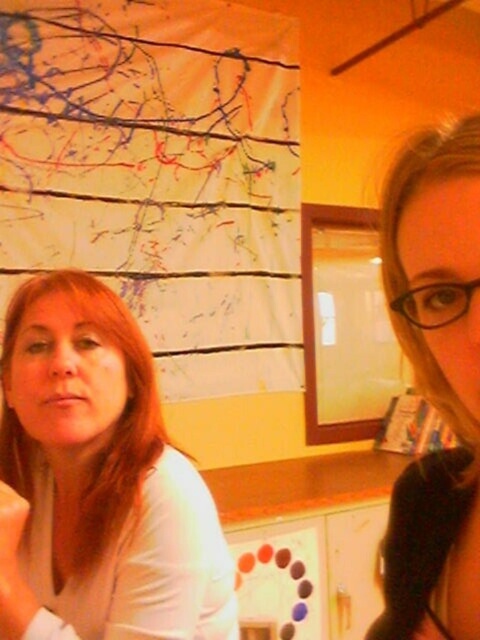
Between smooth beige shirt at left and smooth blonde hair at center, which one has more height?

Standing taller between the two is smooth beige shirt at left.

Is point (189, 582) positioned before point (471, 188)?

That is False.

Locate an element on the screen. This screenshot has width=480, height=640. smooth beige shirt at left is located at coordinates (97, 483).